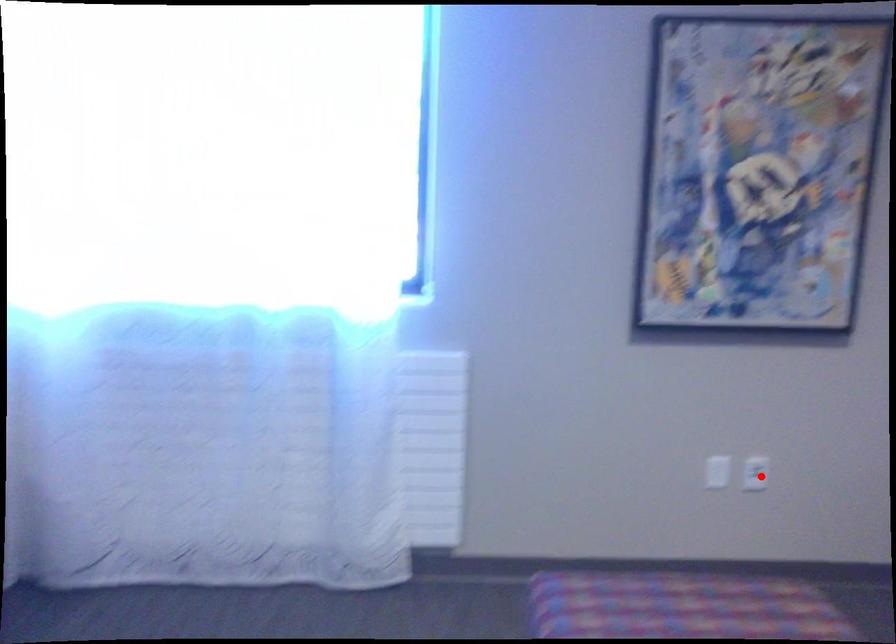
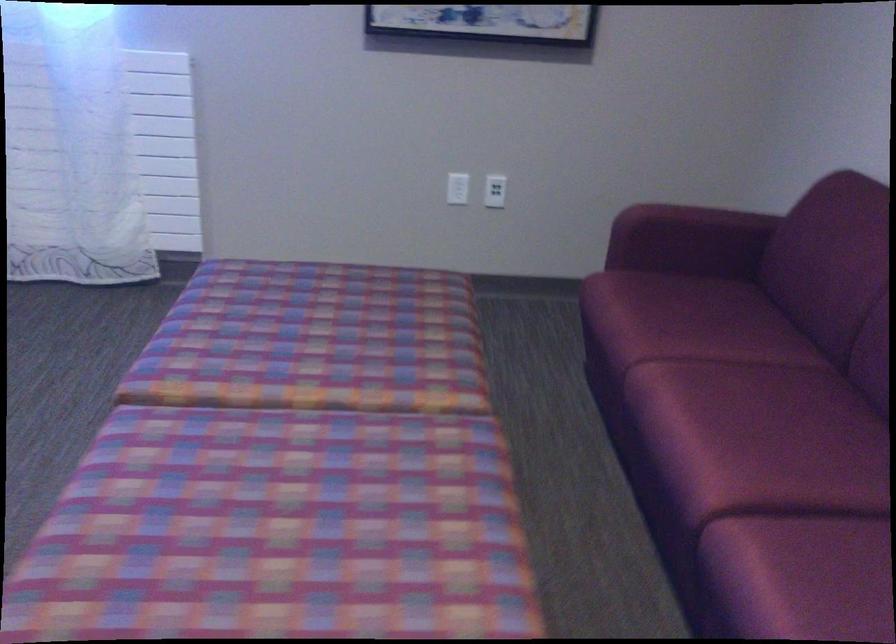
Locate, in the second image, the point that corresponds to the highlighted location in the first image.

(495, 191)